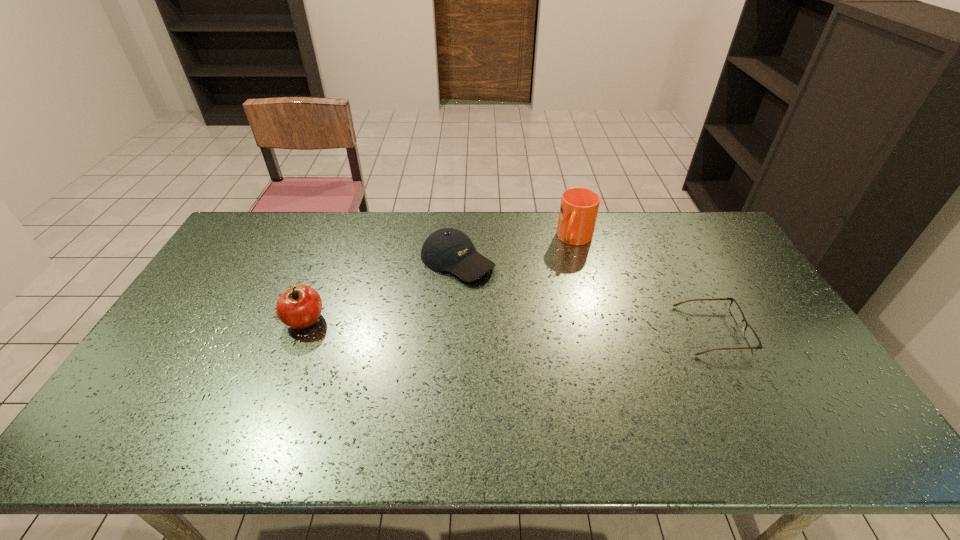
What are the coordinates of `free spot between the apple and the third object from left to right` in the screenshot? It's located at (440, 280).

Locate an element on the screen. The image size is (960, 540). free spot between the tallest object and the apple is located at coordinates (440, 280).

Where is `unoccupied area between the rightmost object and the third object from left to right`? The height and width of the screenshot is (540, 960). unoccupied area between the rightmost object and the third object from left to right is located at coordinates (644, 285).

Locate which object ranks in proximity to the shortest object. Please provide its 2D coordinates. Your answer should be formatted as a tuple, i.e. [(x, y)], where the tuple contains the x and y coordinates of a point satisfying the conditions above.

[(579, 206)]

Select which object is the second closest to the shortest object. Please provide its 2D coordinates. Your answer should be formatted as a tuple, i.e. [(x, y)], where the tuple contains the x and y coordinates of a point satisfying the conditions above.

[(448, 249)]

Locate an element on the screen. This screenshot has height=540, width=960. vacant space that satisfies the following two spatial constraints: 1. on the front side of the baseball cap; 2. on the front-facing side of the shortest object is located at coordinates (453, 330).

The height and width of the screenshot is (540, 960). In order to click on vacant point that satisfies the following two spatial constraints: 1. on the back side of the tallest object; 2. on the left side of the baseball cap in this screenshot , I will do [459, 239].

This screenshot has height=540, width=960. In order to click on vacant space that satisfies the following two spatial constraints: 1. on the back side of the apple; 2. on the right side of the baseball cap in this screenshot , I will do `click(328, 261)`.